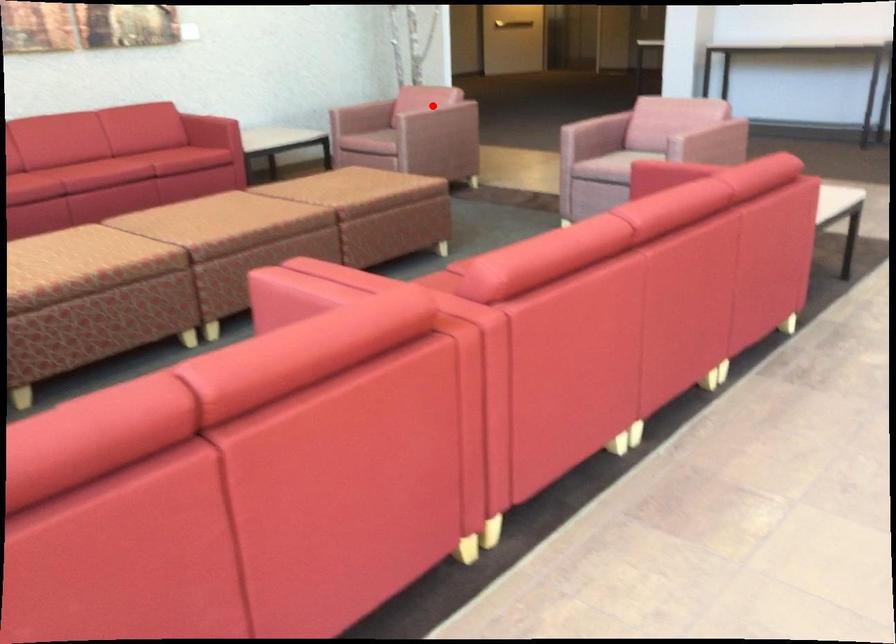
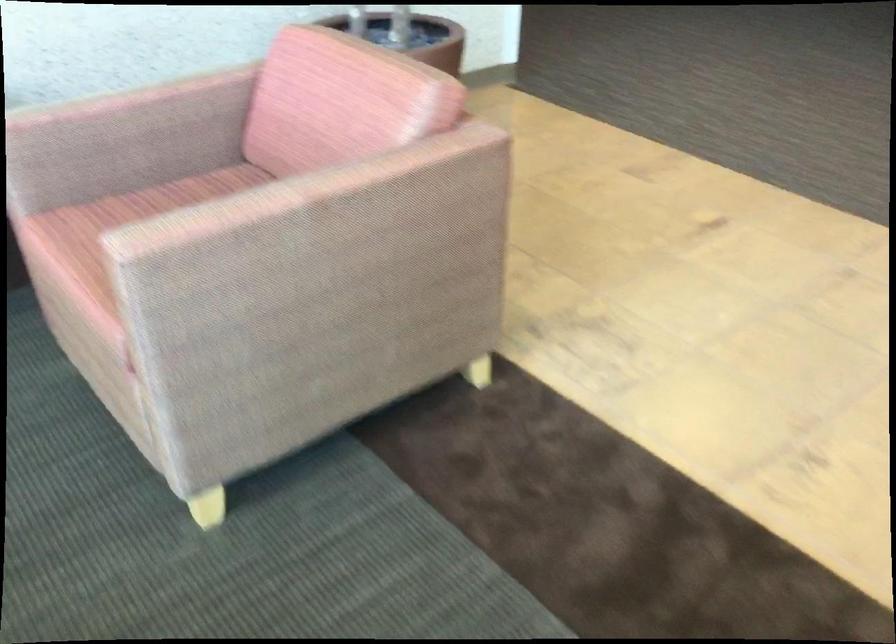
Question: A red point is marked in image1. In image2, is the corresponding 3D point closer to the camera or farther? Reply with the corresponding letter.

Choices:
 (A) The corresponding 3D point is closer.
 (B) The corresponding 3D point is farther.

Answer: (A)